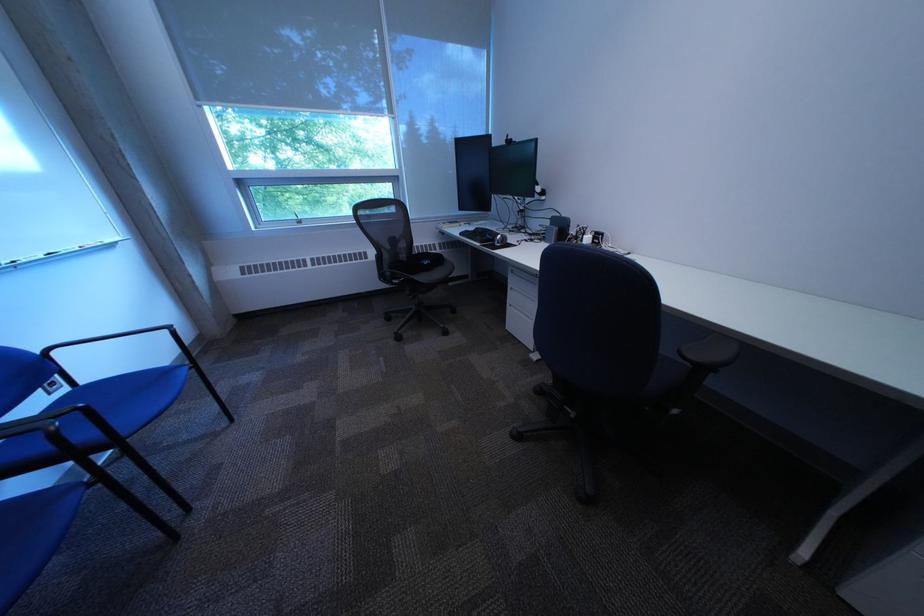
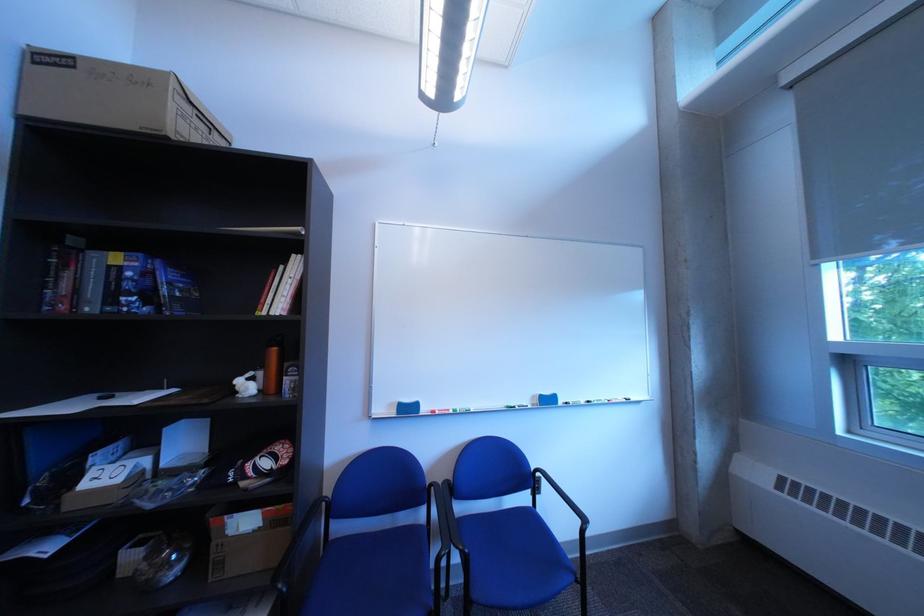
Question: The camera is either moving clockwise (left) or counter-clockwise (right) around the object. The first image is from the beginning of the video and the second image is from the end. Is the camera moving left or right when shooting the video?

Choices:
 (A) Left
 (B) Right

Answer: (B)